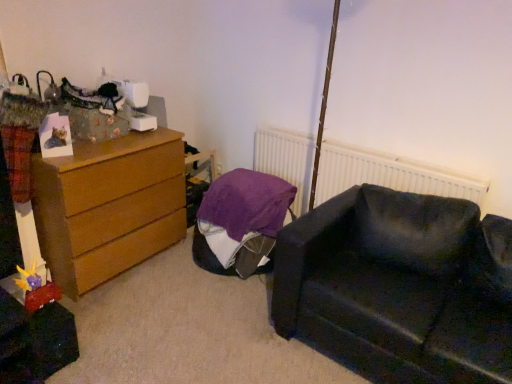
Question: Is dark fabric couch at lower right at the right side of wooden chest of drawers at left?

Choices:
 (A) yes
 (B) no

Answer: (A)

Question: Is dark fabric couch at lower right behind wooden chest of drawers at left?

Choices:
 (A) yes
 (B) no

Answer: (B)

Question: From the image's perspective, is dark fabric couch at lower right below wooden chest of drawers at left?

Choices:
 (A) no
 (B) yes

Answer: (B)

Question: Does dark fabric couch at lower right have a smaller size compared to wooden chest of drawers at left?

Choices:
 (A) yes
 (B) no

Answer: (B)

Question: Is dark fabric couch at lower right bigger than wooden chest of drawers at left?

Choices:
 (A) no
 (B) yes

Answer: (B)

Question: Is dark fabric couch at lower right to the left or to the right of wooden chest of drawers at left in the image?

Choices:
 (A) left
 (B) right

Answer: (B)

Question: Is point (461, 210) closer or farther from the camera than point (68, 221)?

Choices:
 (A) closer
 (B) farther

Answer: (A)

Question: Considering their positions, is dark fabric couch at lower right located in front of or behind wooden chest of drawers at left?

Choices:
 (A) front
 (B) behind

Answer: (A)

Question: Considering the positions of dark fabric couch at lower right and wooden chest of drawers at left in the image, is dark fabric couch at lower right wider or thinner than wooden chest of drawers at left?

Choices:
 (A) wide
 (B) thin

Answer: (A)

Question: From the image's perspective, is wooden chest of drawers at left positioned above or below purple fabric bean bag at center?

Choices:
 (A) below
 (B) above

Answer: (B)

Question: Is point (74, 178) positioned closer to the camera than point (224, 213)?

Choices:
 (A) farther
 (B) closer

Answer: (B)

Question: Looking at the image, does wooden chest of drawers at left seem bigger or smaller compared to purple fabric bean bag at center?

Choices:
 (A) small
 (B) big

Answer: (B)

Question: From a real-world perspective, relative to purple fabric bean bag at center, is wooden chest of drawers at left vertically above or below?

Choices:
 (A) above
 (B) below

Answer: (A)

Question: Do you think white textured radiator at upper center is within wooden chest of drawers at left, or outside of it?

Choices:
 (A) outside
 (B) inside

Answer: (A)

Question: In terms of width, does white textured radiator at upper center look wider or thinner when compared to wooden chest of drawers at left?

Choices:
 (A) thin
 (B) wide

Answer: (A)